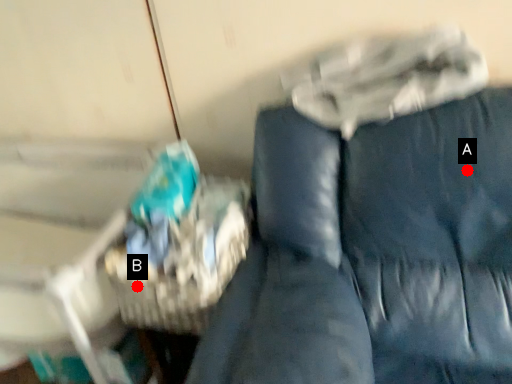
Question: Two points are circled on the image, labeled by A and B beside each circle. Which point appears closest to the camera in this image?

Choices:
 (A) A is closer
 (B) B is closer

Answer: (A)